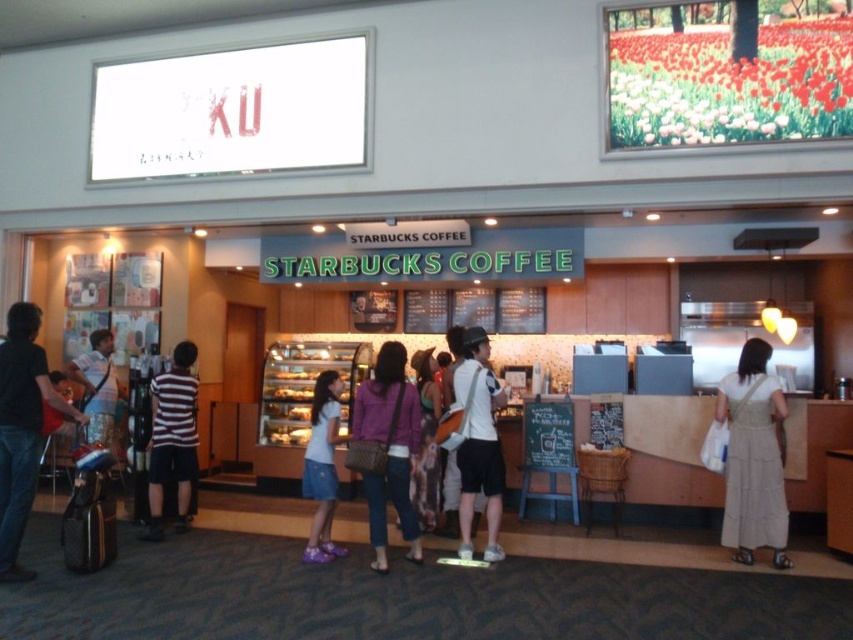
A customer is wearing a white matte shirt at center and a white denim skirt at center. Which clothing item is bigger in size?

The white matte shirt at center is larger in size than the white denim skirt at center.